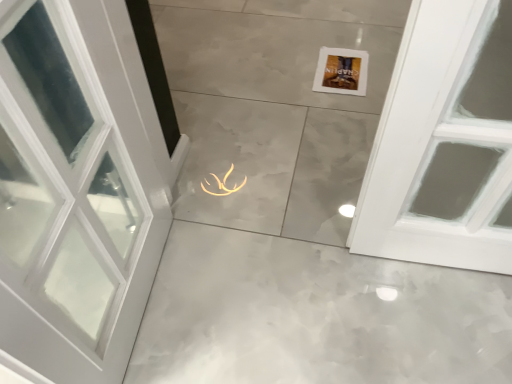
The height and width of the screenshot is (384, 512). I want to click on free point behind matte gold postcard at upper right, so click(x=332, y=40).